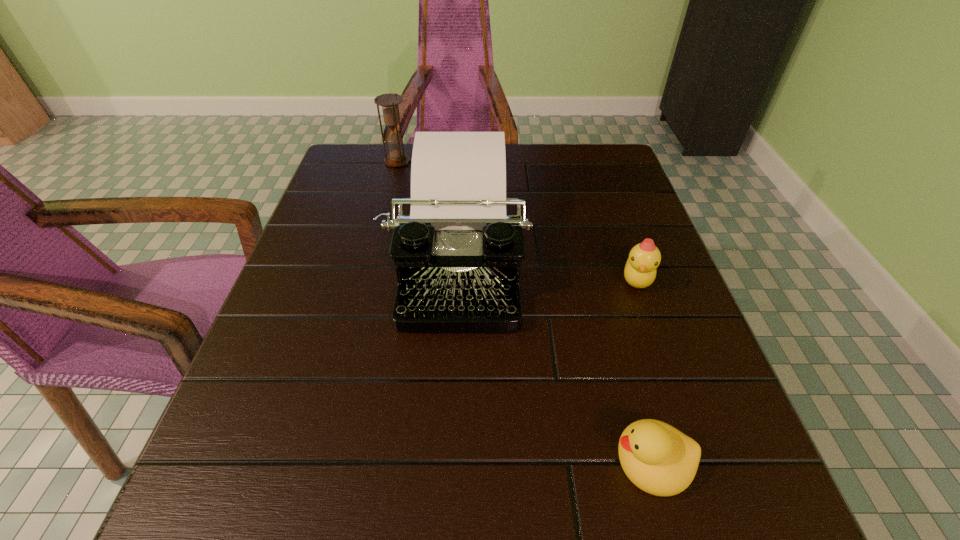
You are a GUI agent. You are given a task and a screenshot of the screen. Output one action in this format:
    pyautogui.click(x=<x>, y=<y>)
    Task: Click on the typewriter
    The width and height of the screenshot is (960, 540).
    Given the screenshot: What is the action you would take?
    pyautogui.click(x=457, y=255)

Find the location of `hourglass`. hourglass is located at coordinates (389, 102).

Locate an element on the screen. This screenshot has height=540, width=960. the taller duckling is located at coordinates (640, 270).

This screenshot has width=960, height=540. I want to click on the farther duckling, so click(x=640, y=270).

Where is `the nearer duckling`? The width and height of the screenshot is (960, 540). the nearer duckling is located at coordinates (659, 459).

The width and height of the screenshot is (960, 540). Identify the location of the shorter duckling. (659, 459).

Where is `vacant space situated on the keys of the typewriter`? vacant space situated on the keys of the typewriter is located at coordinates (450, 373).

Image resolution: width=960 pixels, height=540 pixels. I want to click on free region located on the front of the farthest object, so click(x=388, y=199).

Where is `vacant space located on the front-facing side of the second shortest object`? vacant space located on the front-facing side of the second shortest object is located at coordinates (655, 333).

Locate an element on the screen. This screenshot has height=540, width=960. vacant space positioned 0.290m on the face of the shorter duckling is located at coordinates (407, 461).